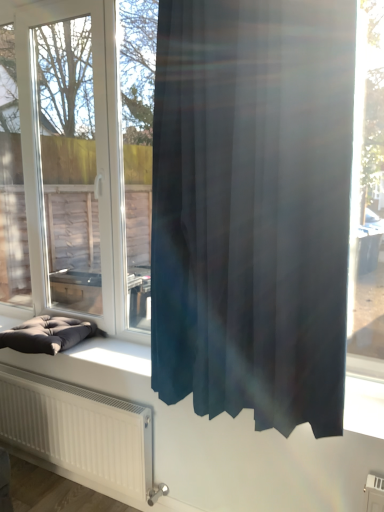
Question: Is satin dark blue curtain at center smaller than transparent glass window at center?

Choices:
 (A) yes
 (B) no

Answer: (A)

Question: Is satin dark blue curtain at center far from transparent glass window at center?

Choices:
 (A) no
 (B) yes

Answer: (B)

Question: Is satin dark blue curtain at center completely or partially outside of transparent glass window at center?

Choices:
 (A) yes
 (B) no

Answer: (A)

Question: Considering the relative positions of satin dark blue curtain at center and transparent glass window at center in the image provided, is satin dark blue curtain at center to the left of transparent glass window at center from the viewer's perspective?

Choices:
 (A) yes
 (B) no

Answer: (B)

Question: Can you confirm if satin dark blue curtain at center is taller than transparent glass window at center?

Choices:
 (A) no
 (B) yes

Answer: (A)

Question: From the image's perspective, does satin dark blue curtain at center appear lower than transparent glass window at center?

Choices:
 (A) no
 (B) yes

Answer: (B)

Question: Is transparent glass window at center positioned beyond the bounds of satin dark blue curtain at center?

Choices:
 (A) no
 (B) yes

Answer: (B)

Question: Can you confirm if transparent glass window at center is positioned to the left of satin dark blue curtain at center?

Choices:
 (A) no
 (B) yes

Answer: (B)

Question: Is satin dark blue curtain at center completely or partially inside transparent glass window at center?

Choices:
 (A) no
 (B) yes

Answer: (A)

Question: Can you confirm if transparent glass window at center is positioned to the right of satin dark blue curtain at center?

Choices:
 (A) no
 (B) yes

Answer: (A)

Question: Is transparent glass window at center turned away from satin dark blue curtain at center?

Choices:
 (A) no
 (B) yes

Answer: (A)

Question: Does transparent glass window at center have a lesser height compared to satin dark blue curtain at center?

Choices:
 (A) no
 (B) yes

Answer: (A)

Question: From the image's perspective, is satin dark blue curtain at center on top of dark gray fabric cushion at lower left?

Choices:
 (A) no
 (B) yes

Answer: (B)